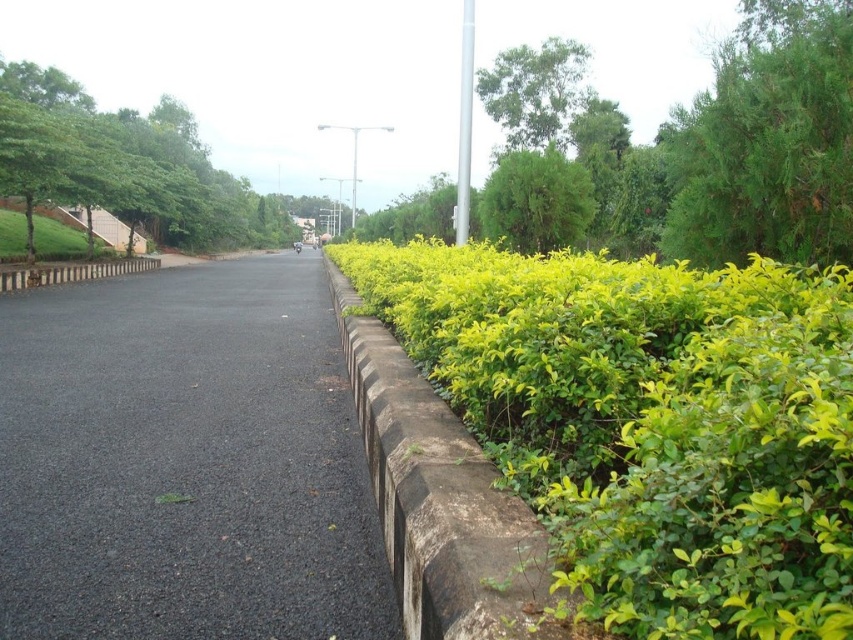
Question: Where is green leafy bush at right located in relation to green leafy tree at left in the image?

Choices:
 (A) left
 (B) right

Answer: (B)

Question: Is green leafy hedge at right below black asphalt pavement at center?

Choices:
 (A) yes
 (B) no

Answer: (B)

Question: Which point is farther to the camera?

Choices:
 (A) green leafy tree at left
 (B) black asphalt pavement at center

Answer: (A)

Question: Estimate the real-world distances between objects in this image. Which object is closer to the black asphalt pavement at center?

Choices:
 (A) green leafy bush at right
 (B) green leafy tree at left
 (C) concrete at right
 (D) green leafy tree at upper right

Answer: (C)

Question: Estimate the real-world distances between objects in this image. Which object is farther from the black asphalt pavement at center?

Choices:
 (A) concrete at right
 (B) green leafy tree at left
 (C) green leafy tree at upper center

Answer: (B)

Question: Does green leafy bush at right have a greater width compared to green leafy tree at upper center?

Choices:
 (A) no
 (B) yes

Answer: (B)